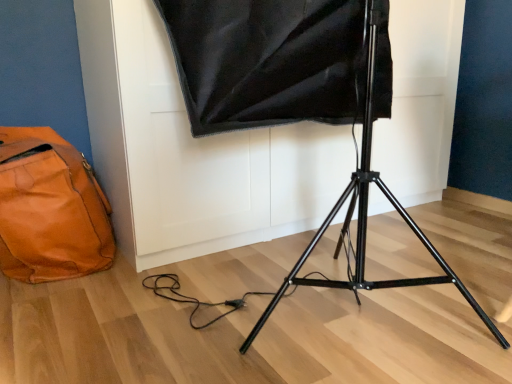
Identify the location of vacant space underneath black matte tripod at center (from a real-world perspective). (347, 307).